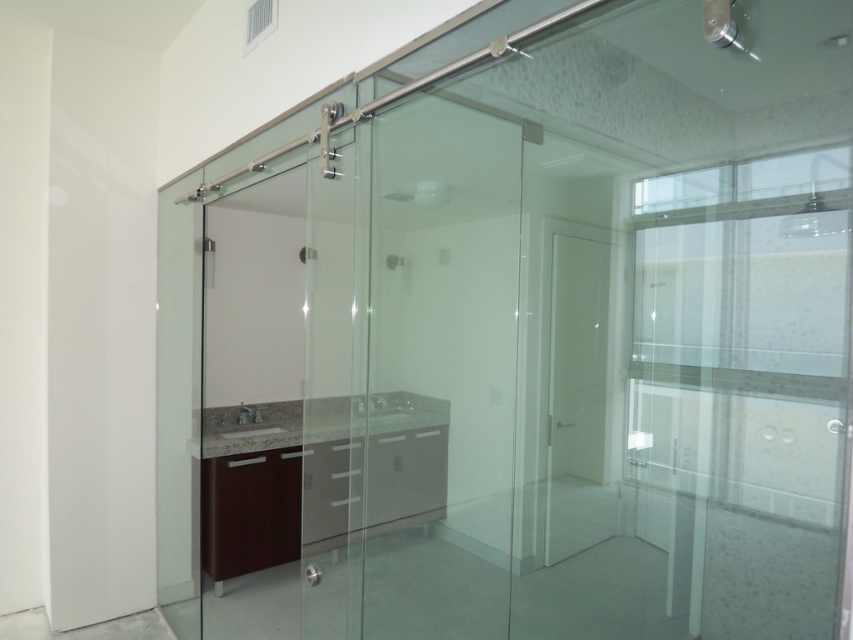
Is gray granite sink at center taller than clear glass shower at center?

Incorrect, gray granite sink at center's height is not larger of clear glass shower at center's.

Is gray granite sink at center in front of clear glass shower at center?

No, gray granite sink at center is behind clear glass shower at center.

This screenshot has height=640, width=853. Describe the element at coordinates (250, 419) in the screenshot. I see `gray granite sink at center` at that location.

Locate an element on the screen. The image size is (853, 640). gray granite sink at center is located at coordinates (250, 419).

Does white matte door at center appear on the left side of clear glass shower at center?

No, white matte door at center is not to the left of clear glass shower at center.

Measure the distance between white matte door at center and camera.

white matte door at center is 3.96 meters from camera.

Identify the location of white matte door at center. (577, 400).

Is point (598, 522) positioned after point (225, 433)?

Yes.

Is white matte door at center to the left of gray granite sink at center from the viewer's perspective?

In fact, white matte door at center is to the right of gray granite sink at center.

Locate an element on the screen. white matte door at center is located at coordinates (577, 400).